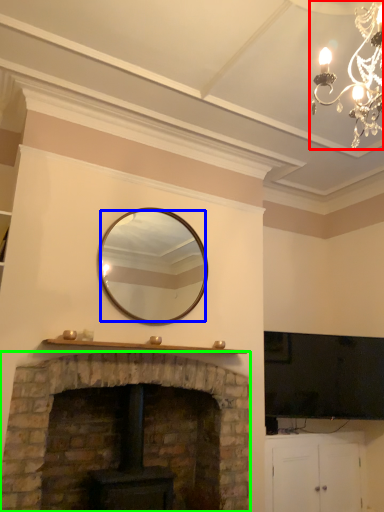
Question: Which object is positioned closest to lamp (highlighted by a red box)? Select from mirror (highlighted by a blue box) and fireplace (highlighted by a green box).

Choices:
 (A) mirror
 (B) fireplace

Answer: (A)